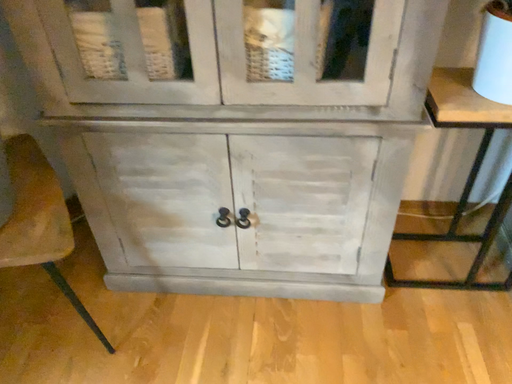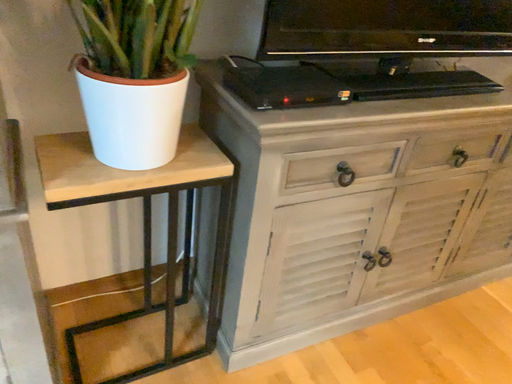
Question: How did the camera likely rotate when shooting the video?

Choices:
 (A) rotated right
 (B) rotated left

Answer: (A)